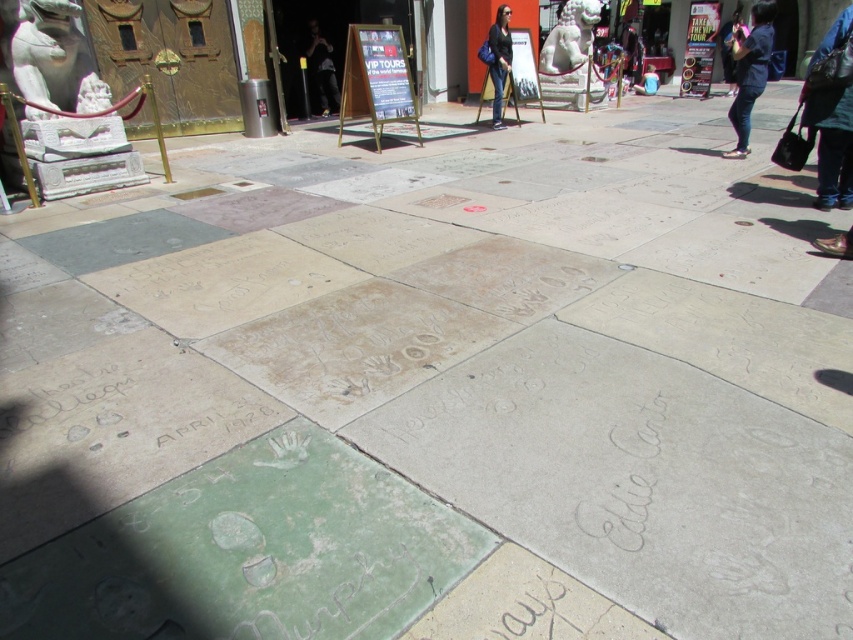
Can you confirm if white marble statue at upper left is taller than dark clothing at center?

No, white marble statue at upper left is not taller than dark clothing at center.

Which is above, white marble statue at upper left or dark clothing at center?

dark clothing at center is above.

Between point (73, 61) and point (326, 56), which one is positioned behind?

The point (326, 56) is behind.

Find the location of a particular element. white marble statue at upper left is located at coordinates (45, 51).

The height and width of the screenshot is (640, 853). Find the location of `green chalk writing at lower center`. green chalk writing at lower center is located at coordinates (532, 602).

Which is behind, point (509, 593) or point (38, 42)?

Point (38, 42)

What are the coordinates of `green chalk writing at lower center` in the screenshot? It's located at (532, 602).

Can you confirm if green chalk writing at lower center is bigger than dark clothing at center?

No, green chalk writing at lower center is not bigger than dark clothing at center.

Does point (490, 595) lie in front of point (310, 20)?

Yes, it is in front of point (310, 20).

Identify the location of green chalk writing at lower center. (532, 602).